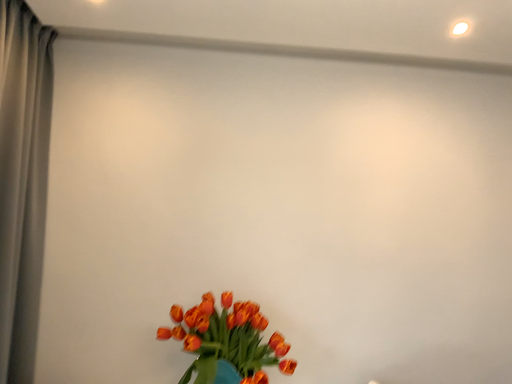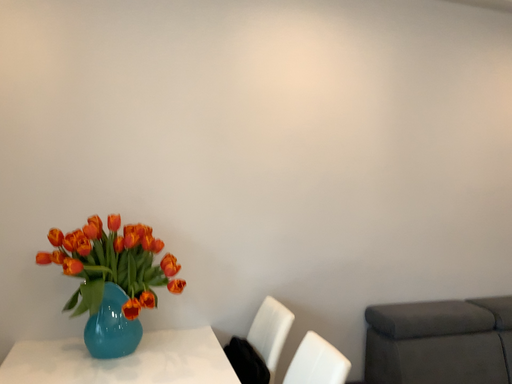
Question: Which way did the camera rotate in the video?

Choices:
 (A) rotated downward
 (B) rotated upward

Answer: (A)